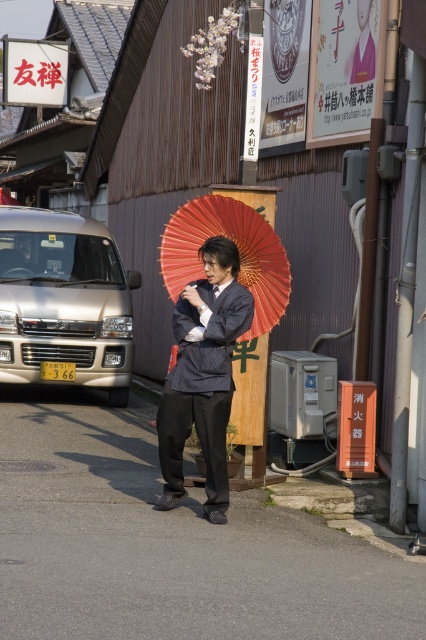
Is metallic gold van at left further to the viewer compared to red paper umbrella at center?

That is True.

Between point (117, 307) and point (284, 300), which one is positioned behind?

Point (117, 307)

The height and width of the screenshot is (640, 426). Identify the location of metallic gold van at left. (63, 301).

Between point (100, 260) and point (209, 486), which one is positioned in front?

Point (209, 486) is in front.

Looking at this image, is metallic gold van at left above striped fabric suit at center?

Indeed, metallic gold van at left is positioned over striped fabric suit at center.

Is point (111, 292) positioned before point (203, 316)?

No, it is not.

You are a GUI agent. You are given a task and a screenshot of the screen. Output one action in this format:
    pyautogui.click(x=<x>, y=<y>)
    Task: Click on the metallic gold van at left
    This screenshot has width=426, height=640.
    Given the screenshot: What is the action you would take?
    click(63, 301)

Which of these two, striped fabric suit at center or red paper umbrella at center, stands shorter?

With less height is red paper umbrella at center.

Who is higher up, striped fabric suit at center or red paper umbrella at center?

Result: red paper umbrella at center is above.

Find the location of a particular element. The image size is (426, 640). striped fabric suit at center is located at coordinates (203, 376).